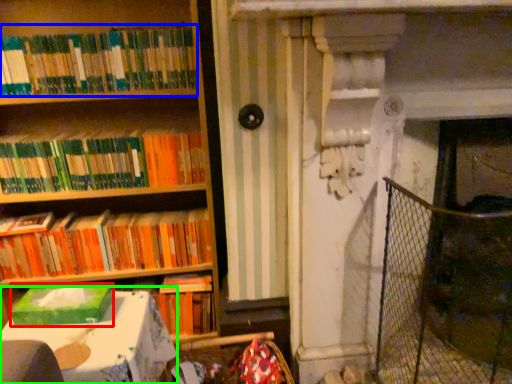
Question: Considering the real-world distances, which object is closest to paperback book (highlighted by a red box)? book (highlighted by a blue box) or table (highlighted by a green box).

Choices:
 (A) book
 (B) table

Answer: (B)